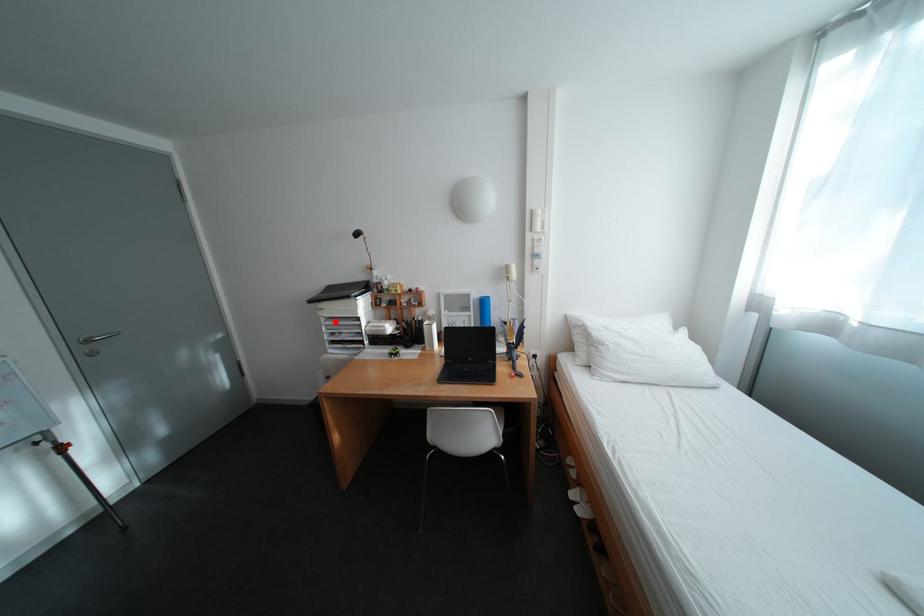
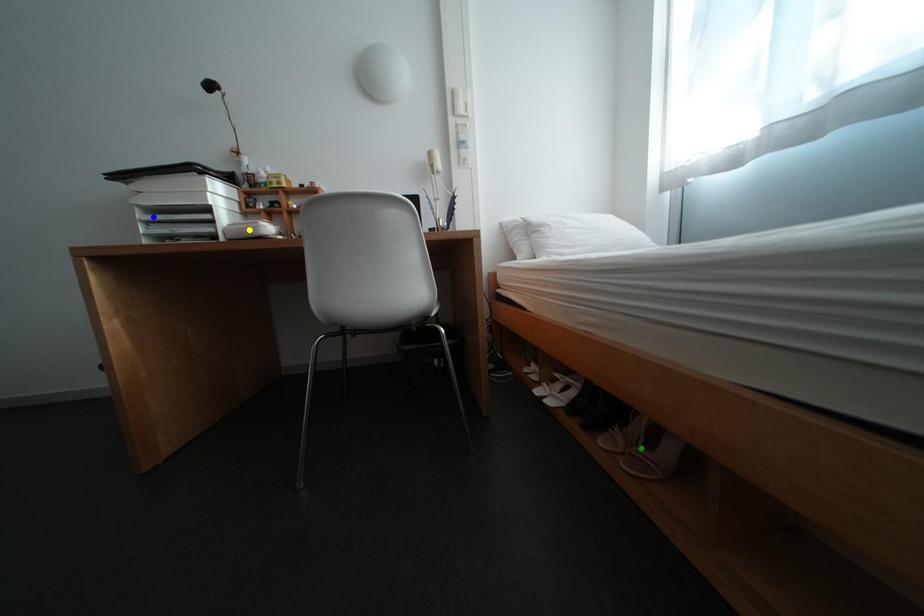
Question: I am providing you with two images of the same scene from different viewpoints. A red point is marked on the first image. You are given multiple points on the second image. Can you choose the point in image 2 that corresponds to the point in image 1?

Choices:
 (A) blue point
 (B) green point
 (C) yellow point

Answer: (A)